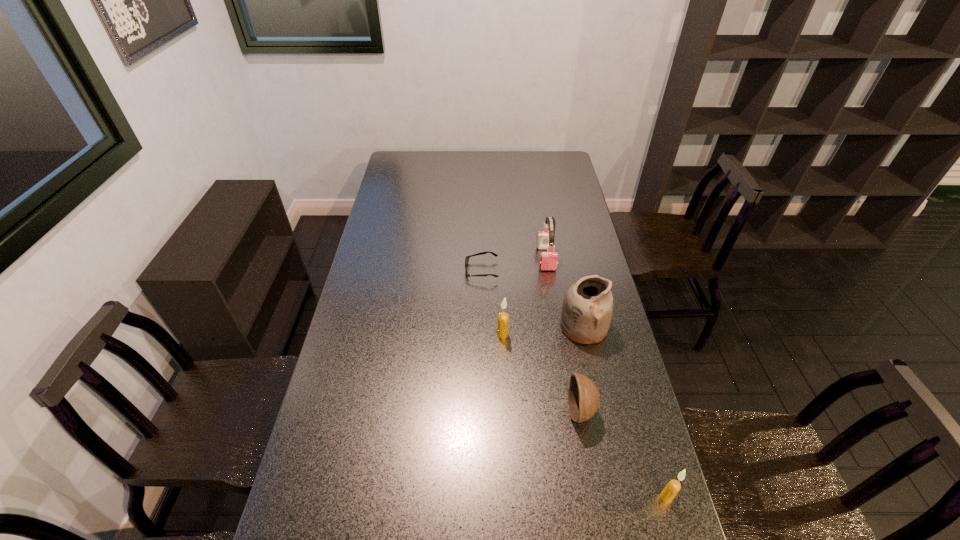
All candles are currently evenly spaced. To continue this pattern, where would you add another candle on the left? Please point out a vacant spot. Please provide its 2D coordinates. Your answer should be formatted as a tuple, i.e. [(x, y)], where the tuple contains the x and y coordinates of a point satisfying the conditions above.

[(404, 237)]